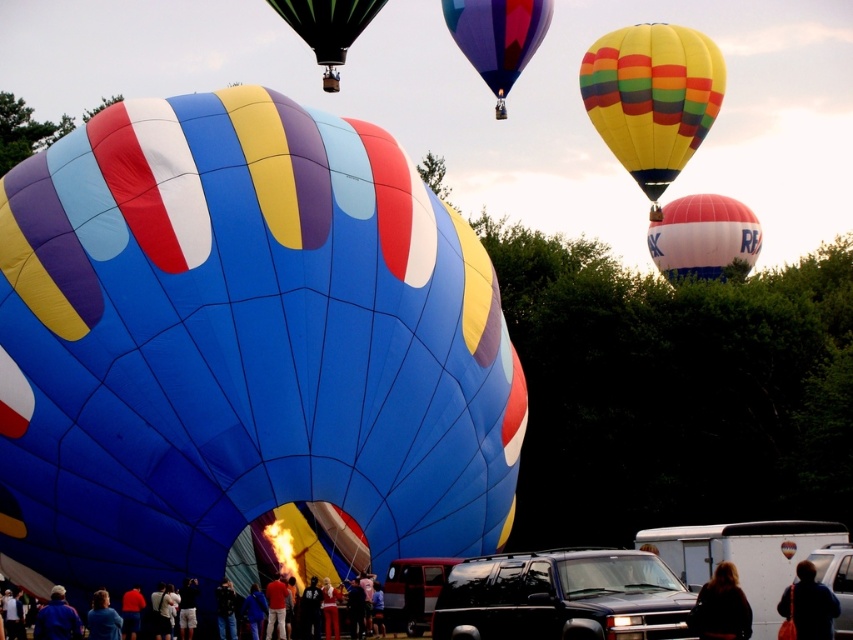
Question: Is white/red/striped balloon at right positioned at the back of green striped hot air balloon at upper center?

Choices:
 (A) yes
 (B) no

Answer: (A)

Question: Which point is closer to the camera taking this photo?

Choices:
 (A) (691, 150)
 (B) (94, 611)
 (C) (698, 216)
 (D) (717, 612)

Answer: (D)

Question: Among these objects, which one is farthest from the camera?

Choices:
 (A) blue fabric pants at lower center
 (B) blue fabric jacket at lower left
 (C) dark blue jacket at lower center

Answer: (A)

Question: Does dark blue jacket at lower right have a lesser width compared to metallic silver truck at center?

Choices:
 (A) no
 (B) yes

Answer: (B)

Question: Considering the relative positions of matte blue fabric hot air balloon at center and blue fabric pants at lower center in the image provided, where is matte blue fabric hot air balloon at center located with respect to blue fabric pants at lower center?

Choices:
 (A) left
 (B) right

Answer: (B)

Question: Which point appears farthest from the camera in this image?

Choices:
 (A) (x=80, y=632)
 (B) (x=227, y=513)

Answer: (B)